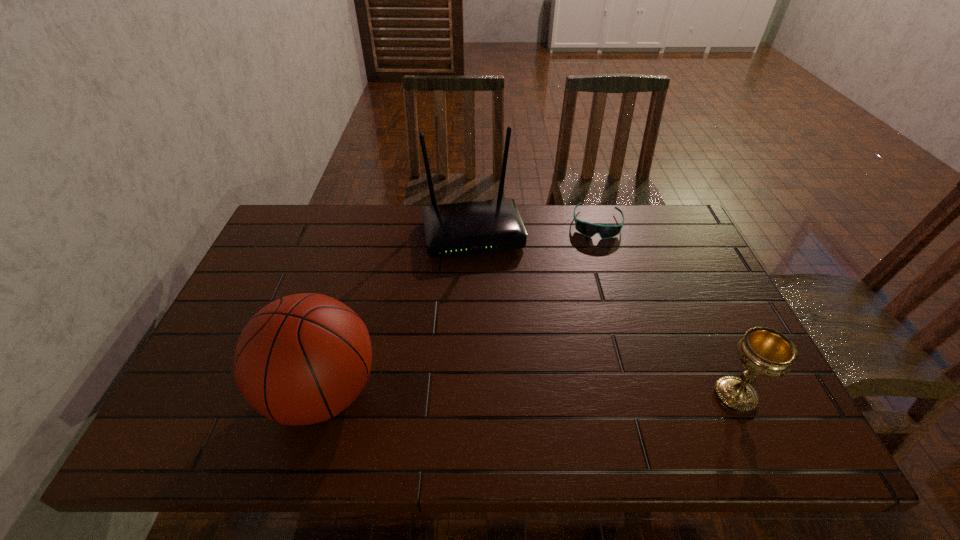
You are a GUI agent. You are given a task and a screenshot of the screen. Output one action in this format:
    pyautogui.click(x=<x>, y=<y>)
    Task: Click on the vacant position in the image that satisfies the following two spatial constraints: 1. on the front side of the chalice; 2. on the right side of the router
    
    Given the screenshot: What is the action you would take?
    pyautogui.click(x=470, y=395)